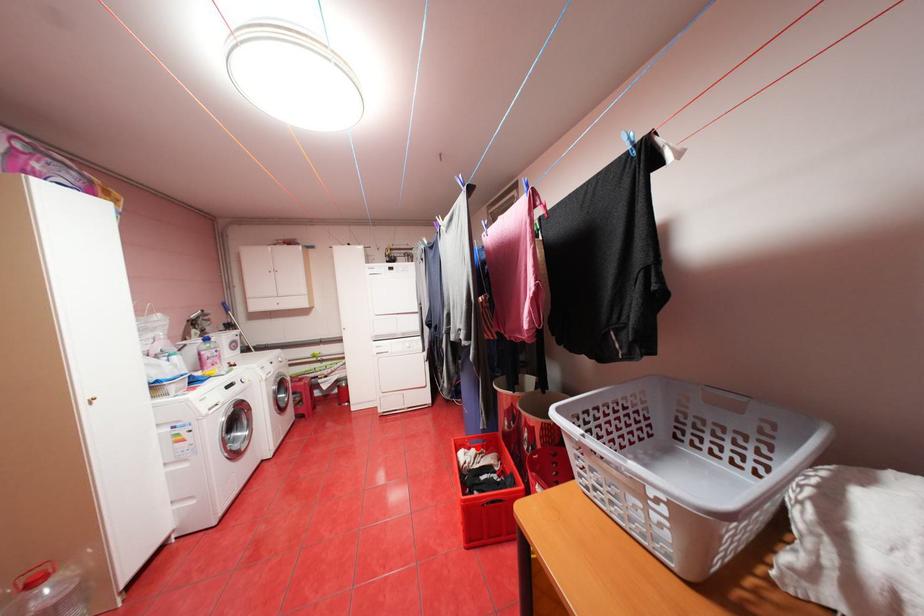
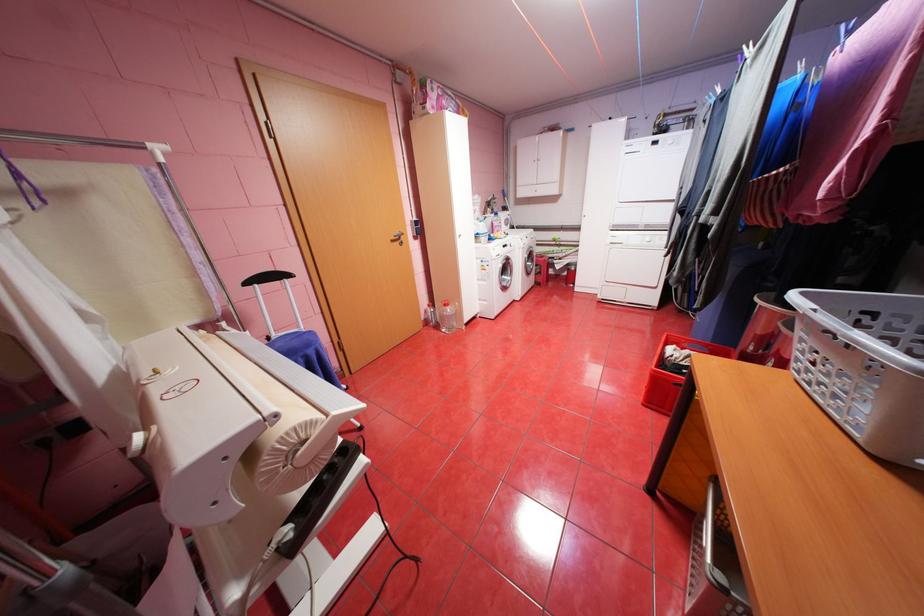
Find the pixel in the second image that matches the highlighted location in the first image.

(691, 349)